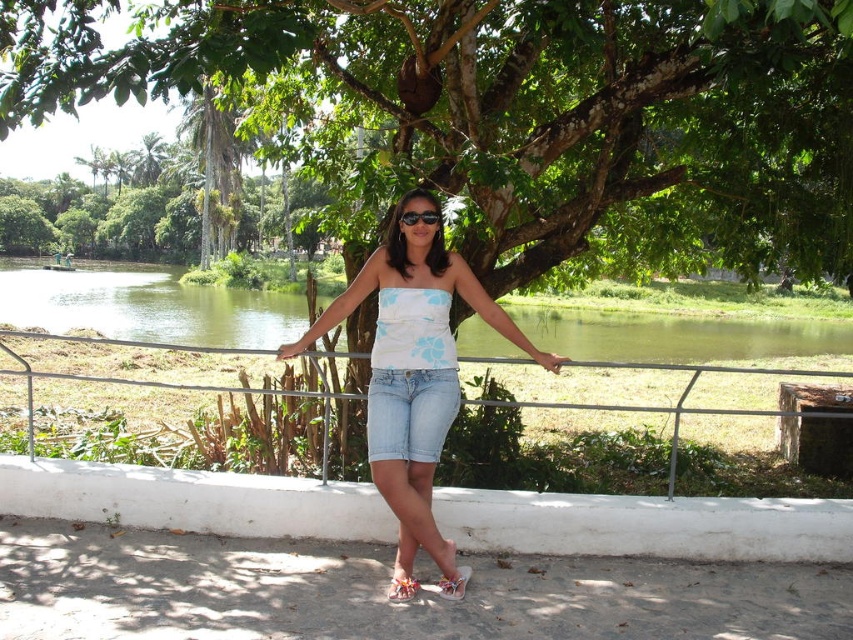
Who is more distant from viewer, (235, 13) or (426, 211)?

Positioned behind is point (235, 13).

Between point (96, 28) and point (403, 224), which one is positioned in front?

Point (403, 224) is more forward.

Where is `green leafy tree at center`? Image resolution: width=853 pixels, height=640 pixels. green leafy tree at center is located at coordinates (512, 109).

Who is taller, green leafy tree at center or white fabric sandal at lower center?

green leafy tree at center

Consider the image. Does green leafy tree at center appear on the left side of white fabric sandal at lower center?

Correct, you'll find green leafy tree at center to the left of white fabric sandal at lower center.

Which is in front, point (137, 44) or point (448, 586)?

Point (448, 586) is in front.

Image resolution: width=853 pixels, height=640 pixels. I want to click on green leafy tree at center, so click(x=512, y=109).

Who is taller, white cotton tank top at center or black plastic sunglasses at center?

Standing taller between the two is white cotton tank top at center.

Who is shorter, white cotton tank top at center or black plastic sunglasses at center?

With less height is black plastic sunglasses at center.

Is point (460, 273) in front of point (436, 212)?

No, it is behind (436, 212).

Where is `white cotton tank top at center`? Image resolution: width=853 pixels, height=640 pixels. white cotton tank top at center is located at coordinates (415, 368).